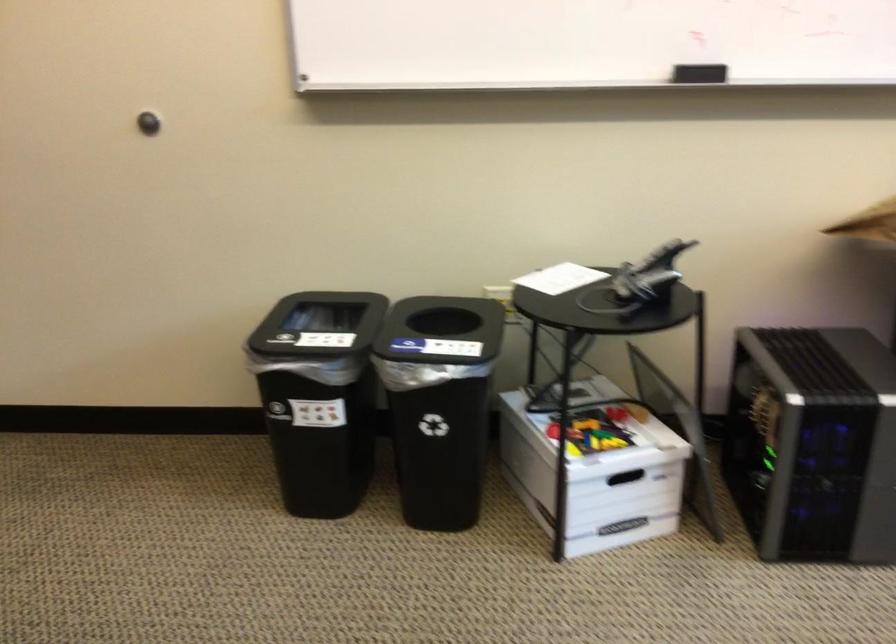
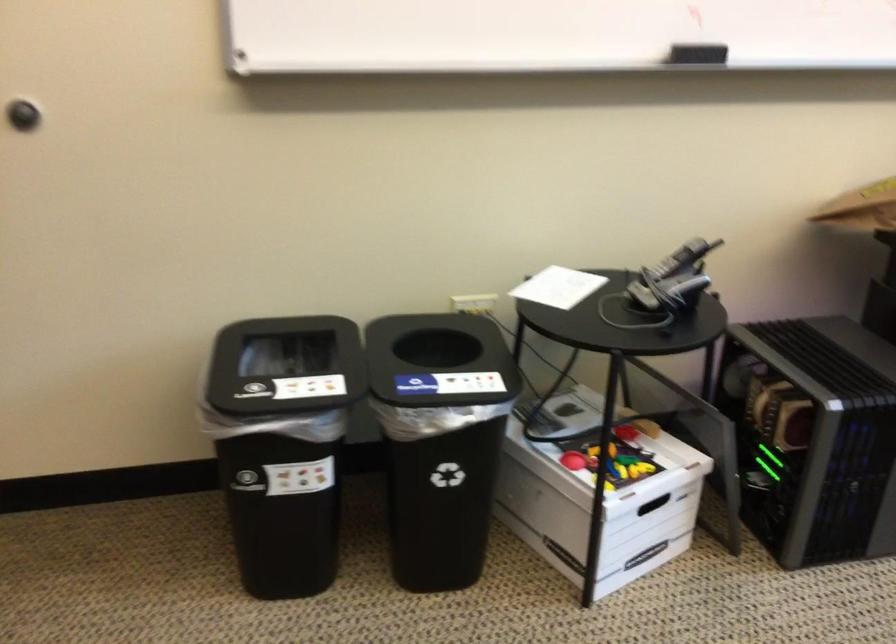
Where in the second image is the point corresponding to (x=564, y=458) from the first image?

(599, 495)